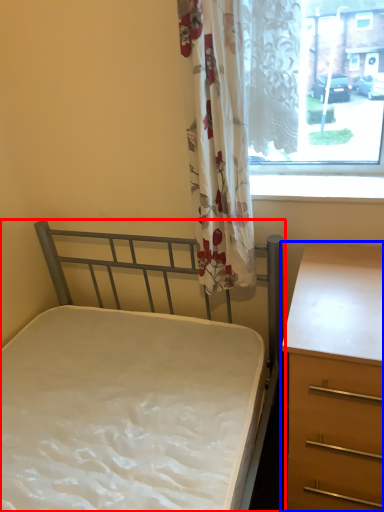
Question: Among these objects, which one is farthest to the camera, bed (highlighted by a red box) or chest of drawers (highlighted by a blue box)?

Choices:
 (A) bed
 (B) chest of drawers

Answer: (B)